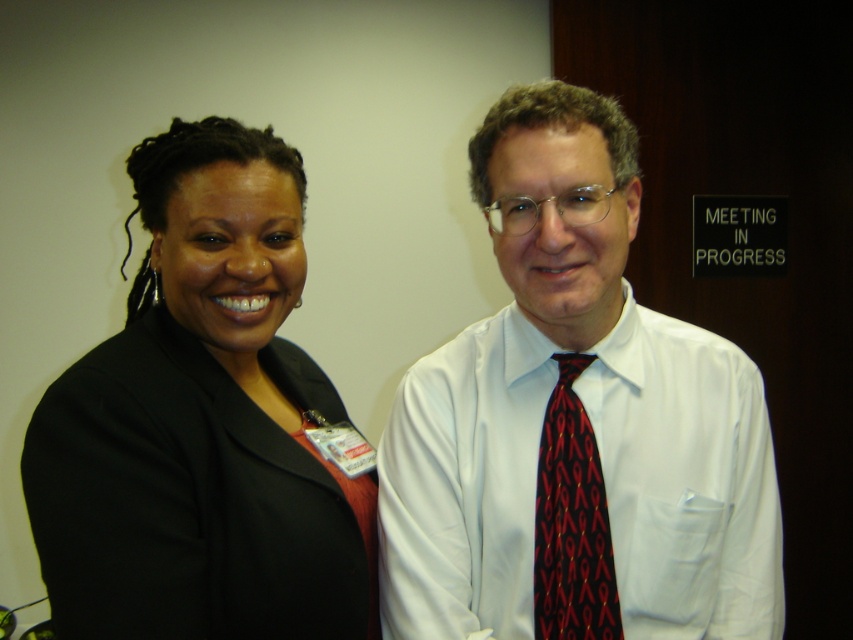
Which is more to the right, black fabric jacket at left or red silk tie at center?

red silk tie at center

Between black fabric jacket at left and red silk tie at center, which one has less height?

Standing shorter between the two is red silk tie at center.

Who is more distant from viewer, (128,378) or (560,451)?

Positioned behind is point (560,451).

Where is `black fabric jacket at left`? This screenshot has height=640, width=853. black fabric jacket at left is located at coordinates (202, 424).

Who is taller, white shirt and tie at center or red silk tie at center?

white shirt and tie at center is taller.

Describe the element at coordinates (575, 422) in the screenshot. I see `white shirt and tie at center` at that location.

This screenshot has width=853, height=640. Identify the location of white shirt and tie at center. (575, 422).

Which is below, white shirt and tie at center or black fabric jacket at left?

white shirt and tie at center is lower down.

Is point (688, 342) less distant than point (128, 449)?

No, it is not.

Find the location of a particular element. The image size is (853, 640). white shirt and tie at center is located at coordinates (575, 422).